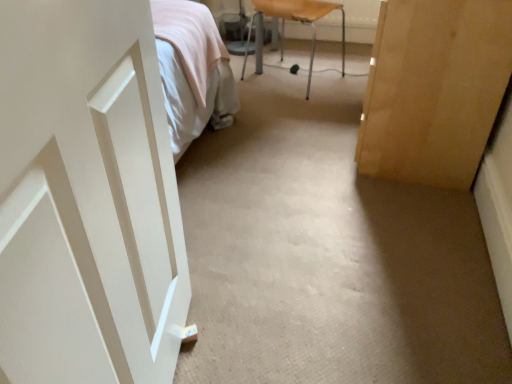
Describe the element at coordinates (294, 20) in the screenshot. The image size is (512, 384). I see `metallic silver chair at upper center` at that location.

Image resolution: width=512 pixels, height=384 pixels. I want to click on metallic silver chair at upper center, so click(294, 20).

Measure the distance between point (253, 18) and camera.

A distance of 9.69 feet exists between point (253, 18) and camera.

Where is `metallic silver chair at upper center`? metallic silver chair at upper center is located at coordinates (294, 20).